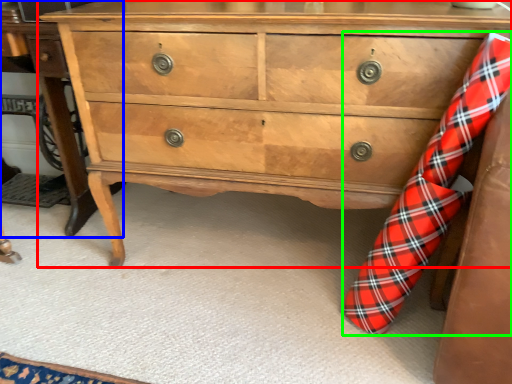
Question: Which object is the farthest from chest of drawers (highlighted by a red box)? Choose among these: table (highlighted by a blue box) or sock (highlighted by a green box).

Choices:
 (A) table
 (B) sock

Answer: (A)